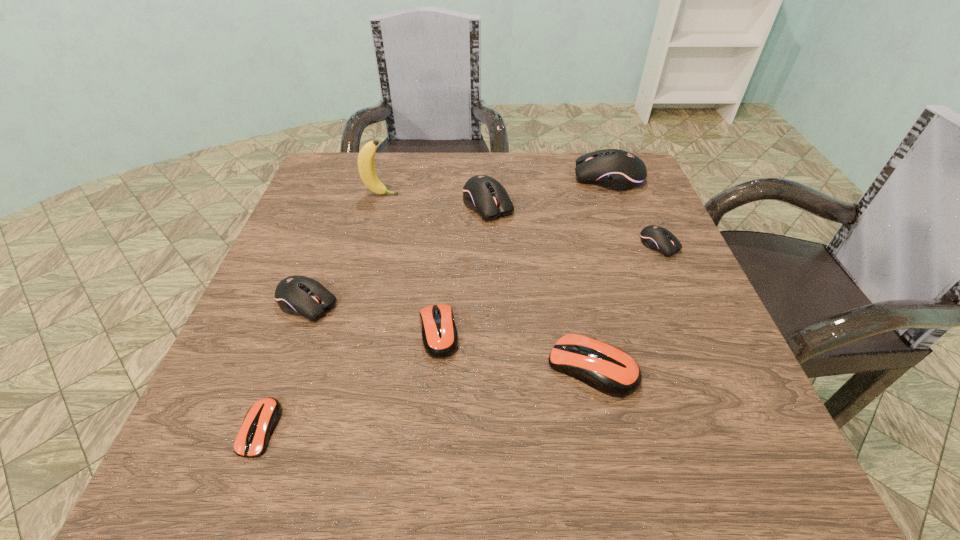
The width and height of the screenshot is (960, 540). Find the location of `free spot between the shortest object and the fifth nearest computer mouse`. free spot between the shortest object and the fifth nearest computer mouse is located at coordinates (460, 336).

Point out which object is positioned as the fifth nearest to the smallest black computer mouse. Please provide its 2D coordinates. Your answer should be formatted as a tuple, i.e. [(x, y)], where the tuple contains the x and y coordinates of a point satisfying the conditions above.

[(366, 167)]

In order to click on object that is the second closest to the rightmost orange computer mouse in this screenshot , I will do (x=657, y=238).

Identify the location of computer mouse that is the fourth nearest to the tallest computer mouse. This screenshot has width=960, height=540. (439, 333).

Locate which computer mouse is the fifth closest to the tallest computer mouse. Please provide its 2D coordinates. Your answer should be formatted as a tuple, i.e. [(x, y)], where the tuple contains the x and y coordinates of a point satisfying the conditions above.

[(298, 295)]

This screenshot has width=960, height=540. Find the location of `black computer mouse that is the second closest to the second smallest orange computer mouse`. black computer mouse that is the second closest to the second smallest orange computer mouse is located at coordinates (483, 194).

The height and width of the screenshot is (540, 960). I want to click on black computer mouse that can be found as the second closest to the second tallest object, so click(x=483, y=194).

Where is `the closest orange computer mouse to the nearest orange computer mouse`? the closest orange computer mouse to the nearest orange computer mouse is located at coordinates (439, 333).

I want to click on the closest orange computer mouse to the second orange computer mouse from right to left, so click(x=606, y=368).

Where is `vacant point that satisfies the following two spatial constraints: 1. on the front side of the second black computer mouse from left to right; 2. on the left side of the third farthest computer mouse`? This screenshot has height=540, width=960. vacant point that satisfies the following two spatial constraints: 1. on the front side of the second black computer mouse from left to right; 2. on the left side of the third farthest computer mouse is located at coordinates (489, 245).